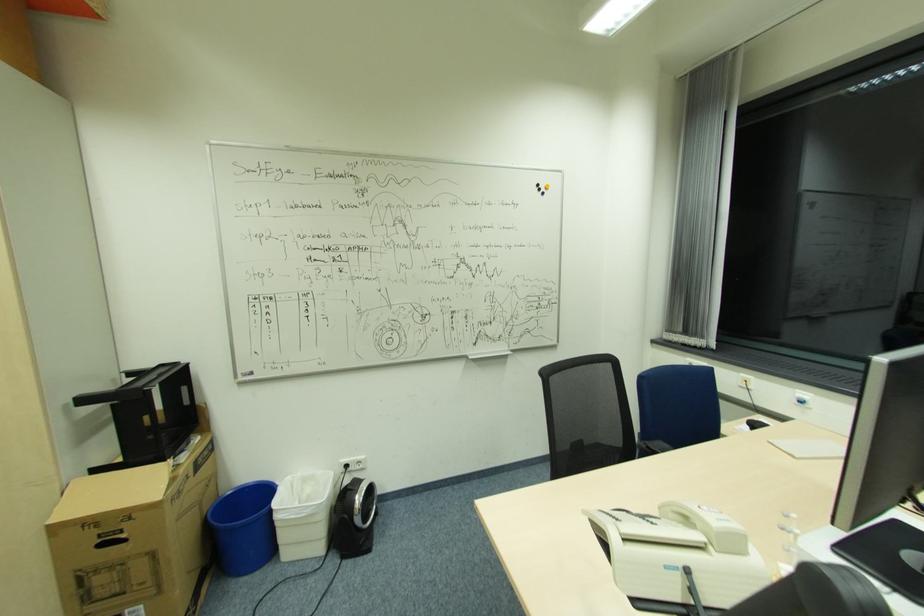
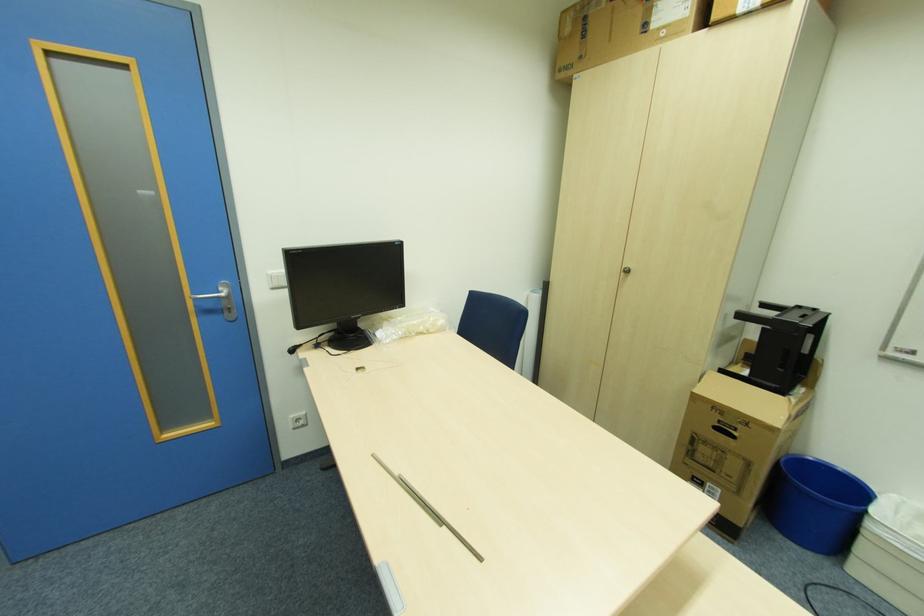
Find the pixel in the second image that matches point 131,517 in the first image.

(748, 424)